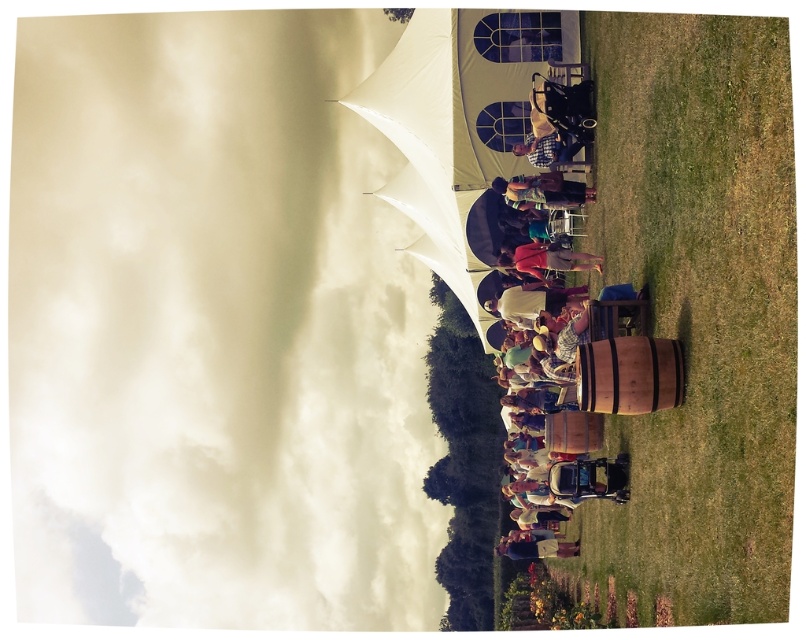
Which is more to the right, wooden barrel at center or wooden chair at center?

From the viewer's perspective, wooden chair at center appears more on the right side.

The width and height of the screenshot is (806, 640). What do you see at coordinates (563, 104) in the screenshot?
I see `wooden barrel at center` at bounding box center [563, 104].

Between point (563, 90) and point (542, 141), which one is positioned behind?

Positioned behind is point (542, 141).

Find the location of `wooden barrel at center`. wooden barrel at center is located at coordinates (563, 104).

Can you confirm if white matte umbrella at upper center is positioned below denim jacket at lower center?

No.

Is point (472, 164) positioned behind point (564, 547)?

Yes.

Image resolution: width=806 pixels, height=640 pixels. What are the coordinates of `white matte umbrella at upper center` in the screenshot? It's located at [x=459, y=129].

Is point (364, 93) more distant than point (528, 259)?

Yes.

Is the position of white matte umbrella at upper center more distant than that of wooden barrel at center?

Yes, white matte umbrella at upper center is further from the viewer.

What do you see at coordinates (459, 129) in the screenshot?
I see `white matte umbrella at upper center` at bounding box center [459, 129].

What are the coordinates of `white matte umbrella at upper center` in the screenshot? It's located at (459, 129).